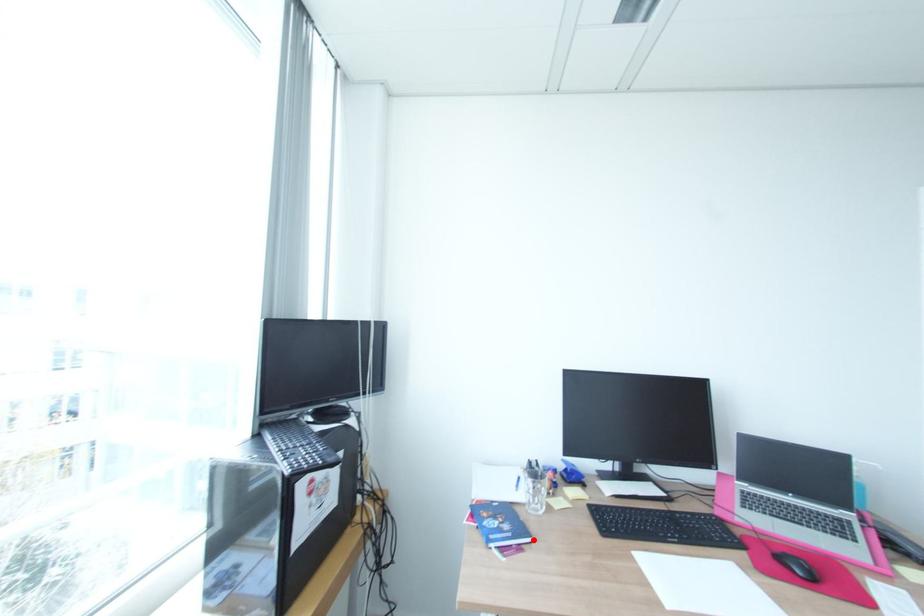
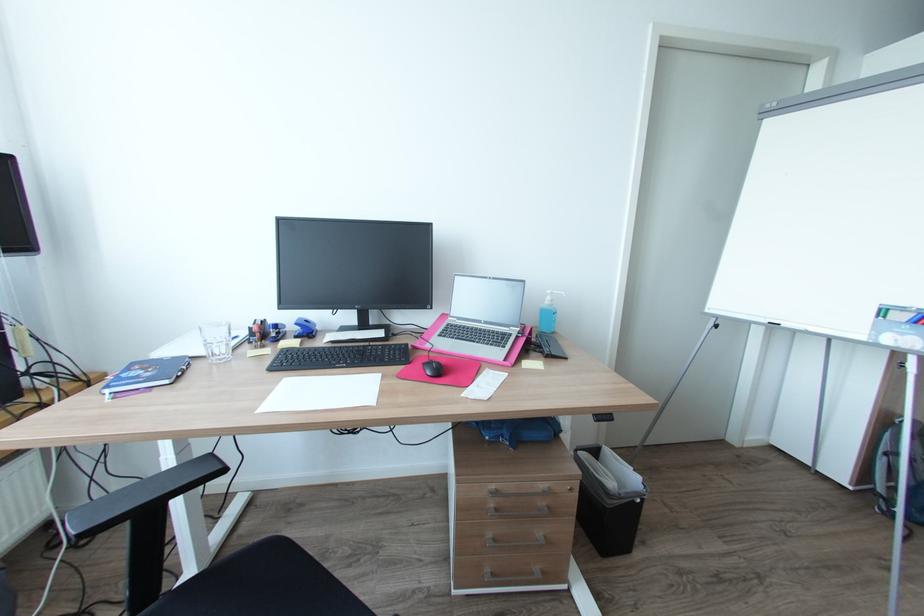
Question: I am providing you with two images of the same scene from different viewpoints. A red point is marked on the first image. Is the red point's position out of view in image 2?

Choices:
 (A) Yes
 (B) No

Answer: (B)